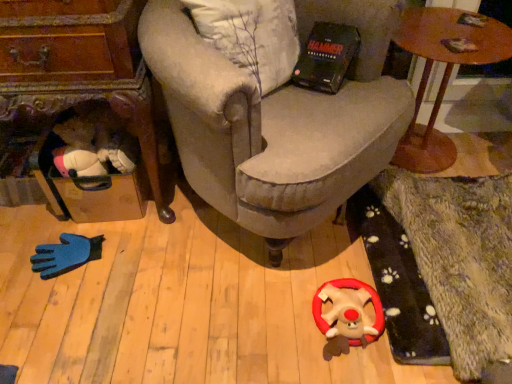
In order to click on velvet beige armchair at center in this screenshot , I will do `click(278, 120)`.

The image size is (512, 384). What do you see at coordinates (347, 314) in the screenshot? I see `fluffy plush toy at center` at bounding box center [347, 314].

Find the location of `wooden round table at upper right, the first table in the right-to-left sequence`. wooden round table at upper right, the first table in the right-to-left sequence is located at coordinates (444, 73).

Who is shorter, fluffy plush toy at center or wooden round table at upper right, the first table in the right-to-left sequence?

Standing shorter between the two is fluffy plush toy at center.

Which object is wider, fluffy plush toy at center or wooden round table at upper right, which is counted as the 2th table, starting from the left?

wooden round table at upper right, which is counted as the 2th table, starting from the left, is wider.

Locate an element on the screen. toy that appears in front of the wooden round table at upper right, the first table in the right-to-left sequence is located at coordinates pos(347,314).

From a real-world perspective, is wooden suitcase at left, arranged as the 1th table when viewed from the left, physically located above or below velvet beige armchair at center?

wooden suitcase at left, arranged as the 1th table when viewed from the left, is below velvet beige armchair at center.

Does point (108, 50) come behind point (197, 154)?

No, it is not.

Find the location of `table on the left of velvet beige armchair at center`. table on the left of velvet beige armchair at center is located at coordinates (79, 66).

Does wooden suitcase at left, arranged as the 1th table when viewed from the left, touch velvet beige armchair at center?

No, wooden suitcase at left, arranged as the 1th table when viewed from the left, is not with velvet beige armchair at center.

Can you confirm if fluffy plush toy at center is positioned to the left of wooden suitcase at left, marked as the 2th table in a right-to-left arrangement?

No.

Considering the relative sizes of fluffy plush toy at center and wooden suitcase at left, arranged as the 1th table when viewed from the left, in the image provided, is fluffy plush toy at center bigger than wooden suitcase at left, arranged as the 1th table when viewed from the left,?

Actually, fluffy plush toy at center might be smaller than wooden suitcase at left, arranged as the 1th table when viewed from the left.

Looking at this image, which of these two, fluffy plush toy at center or wooden suitcase at left, arranged as the 1th table when viewed from the left, is wider?

With larger width is wooden suitcase at left, arranged as the 1th table when viewed from the left.

Does wooden round table at upper right, the first table in the right-to-left sequence, have a greater height compared to velvet beige armchair at center?

No.

You are a GUI agent. You are given a task and a screenshot of the screen. Output one action in this format:
    pyautogui.click(x=<x>, y=<y>)
    Task: Click on the 1st table below the velvet beige armchair at center (from a real-world perspective)
    The width and height of the screenshot is (512, 384).
    Given the screenshot: What is the action you would take?
    tap(444, 73)

From the image's perspective, is wooden round table at upper right, the first table in the right-to-left sequence, located beneath velvet beige armchair at center?

No.

Is velvet beige armchair at center a part of wooden round table at upper right, which is counted as the 2th table, starting from the left?

No, velvet beige armchair at center is not a part of wooden round table at upper right, which is counted as the 2th table, starting from the left.

Are velvet beige armchair at center and wooden suitcase at left, arranged as the 1th table when viewed from the left, beside each other?

They are not placed beside each other.

From the image's perspective, is velvet beige armchair at center over wooden suitcase at left, arranged as the 1th table when viewed from the left?

Correct, velvet beige armchair at center appears higher than wooden suitcase at left, arranged as the 1th table when viewed from the left, in the image.

Between velvet beige armchair at center and wooden suitcase at left, arranged as the 1th table when viewed from the left, which one is positioned behind?

wooden suitcase at left, arranged as the 1th table when viewed from the left, is further from the camera.

Considering the relative positions of velvet beige armchair at center and wooden suitcase at left, marked as the 2th table in a right-to-left arrangement, in the image provided, is velvet beige armchair at center to the left or to the right of wooden suitcase at left, marked as the 2th table in a right-to-left arrangement,?

Clearly, velvet beige armchair at center is on the right of wooden suitcase at left, marked as the 2th table in a right-to-left arrangement, in the image.

Image resolution: width=512 pixels, height=384 pixels. In the image, there is a wooden round table at upper right, the first table in the right-to-left sequence. What are the coordinates of `toy below it (from a real-world perspective)` in the screenshot? It's located at (347, 314).

Could you measure the distance between wooden round table at upper right, which is counted as the 2th table, starting from the left, and fluffy plush toy at center?

They are 31.73 inches apart.

Based on the photo, how different are the orientations of wooden round table at upper right, the first table in the right-to-left sequence, and fluffy plush toy at center in degrees?

They differ by 4.7 degrees in their facing directions.

In terms of size, does wooden round table at upper right, which is counted as the 2th table, starting from the left, appear bigger or smaller than fluffy plush toy at center?

Clearly, wooden round table at upper right, which is counted as the 2th table, starting from the left, is larger in size than fluffy plush toy at center.

Are wooden suitcase at left, marked as the 2th table in a right-to-left arrangement, and fluffy plush toy at center making contact?

They are not placed beside each other.

Which of these two, wooden suitcase at left, marked as the 2th table in a right-to-left arrangement, or fluffy plush toy at center, is bigger?

wooden suitcase at left, marked as the 2th table in a right-to-left arrangement.

Is wooden suitcase at left, marked as the 2th table in a right-to-left arrangement, facing towards fluffy plush toy at center?

No, wooden suitcase at left, marked as the 2th table in a right-to-left arrangement, is not oriented towards fluffy plush toy at center.

From the image's perspective, is wooden suitcase at left, arranged as the 1th table when viewed from the left, above or below fluffy plush toy at center?

wooden suitcase at left, arranged as the 1th table when viewed from the left, is above fluffy plush toy at center.

There is a fluffy plush toy at center. At what (x,y) coordinates should I click in order to perform the action: click on the 2nd table above it (from the image's perspective). Please return your answer as a coordinate pair (x, y). Image resolution: width=512 pixels, height=384 pixels. Looking at the image, I should click on (444, 73).

Locate an element on the screen. chair in front of the wooden suitcase at left, arranged as the 1th table when viewed from the left is located at coordinates (278, 120).

Estimate the real-world distances between objects in this image. Which object is further from wooden round table at upper right, which is counted as the 2th table, starting from the left, fluffy plush toy at center or velvet beige armchair at center?

The object further to wooden round table at upper right, which is counted as the 2th table, starting from the left, is fluffy plush toy at center.

Which object lies nearer to the anchor point velvet beige armchair at center, wooden round table at upper right, which is counted as the 2th table, starting from the left, or fluffy plush toy at center?

wooden round table at upper right, which is counted as the 2th table, starting from the left, lies closer to velvet beige armchair at center than the other object.

Which object lies further to the anchor point wooden round table at upper right, which is counted as the 2th table, starting from the left, velvet beige armchair at center or wooden suitcase at left, marked as the 2th table in a right-to-left arrangement?

wooden suitcase at left, marked as the 2th table in a right-to-left arrangement, lies further to wooden round table at upper right, which is counted as the 2th table, starting from the left, than the other object.

Based on their spatial positions, is wooden suitcase at left, arranged as the 1th table when viewed from the left, or velvet beige armchair at center further from fluffy plush toy at center?

wooden suitcase at left, arranged as the 1th table when viewed from the left, is further to fluffy plush toy at center.

Looking at the image, which one is located further to fluffy plush toy at center, velvet beige armchair at center or wooden suitcase at left, arranged as the 1th table when viewed from the left?

wooden suitcase at left, arranged as the 1th table when viewed from the left, is further to fluffy plush toy at center.

From the image, which object appears to be farther from wooden round table at upper right, the first table in the right-to-left sequence, fluffy plush toy at center or wooden suitcase at left, marked as the 2th table in a right-to-left arrangement?

wooden suitcase at left, marked as the 2th table in a right-to-left arrangement, lies further to wooden round table at upper right, the first table in the right-to-left sequence, than the other object.

When comparing their distances from wooden suitcase at left, arranged as the 1th table when viewed from the left, does fluffy plush toy at center or wooden round table at upper right, the first table in the right-to-left sequence, seem further?

wooden round table at upper right, the first table in the right-to-left sequence, is positioned further to the anchor wooden suitcase at left, arranged as the 1th table when viewed from the left.

Which object lies further to the anchor point fluffy plush toy at center, wooden round table at upper right, which is counted as the 2th table, starting from the left, or wooden suitcase at left, marked as the 2th table in a right-to-left arrangement?

wooden suitcase at left, marked as the 2th table in a right-to-left arrangement, is further to fluffy plush toy at center.

Identify the location of chair between wooden suitcase at left, marked as the 2th table in a right-to-left arrangement, and fluffy plush toy at center from left to right. (278, 120).

Identify the location of toy between wooden suitcase at left, arranged as the 1th table when viewed from the left, and wooden round table at upper right, the first table in the right-to-left sequence, in the horizontal direction. (347, 314).

Where is `chair between wooden round table at upper right, which is counted as the 2th table, starting from the left, and fluffy plush toy at center from top to bottom`? chair between wooden round table at upper right, which is counted as the 2th table, starting from the left, and fluffy plush toy at center from top to bottom is located at coordinates (278, 120).

Find the location of a particular element. Image resolution: width=512 pixels, height=384 pixels. chair between wooden suitcase at left, marked as the 2th table in a right-to-left arrangement, and wooden round table at upper right, the first table in the right-to-left sequence is located at coordinates (278, 120).